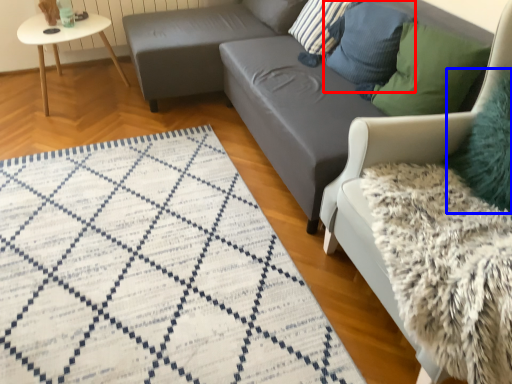
Question: Which point is further to the camera, pillow (highlighted by a red box) or pillow (highlighted by a blue box)?

Choices:
 (A) pillow
 (B) pillow

Answer: (A)